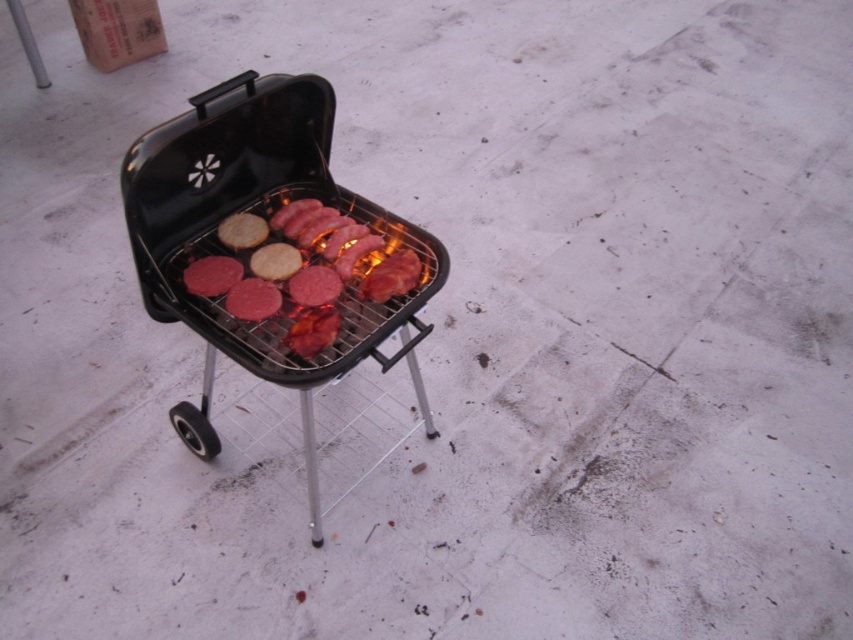
You are standing in front of the barbecue grill and want to place a spatula between the two points, point(x=233, y=237) and point(x=235, y=276). Which point should you place the spatula closer to so that it appears closer to you?

You should place the spatula closer to point(x=233, y=237) because it is closer to you than point(x=235, y=276).